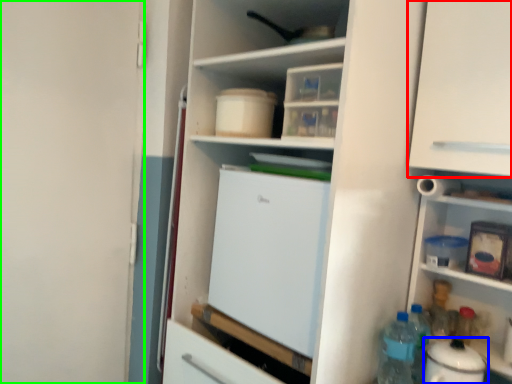
Question: Which object is positioned farthest from cabinetry (highlighted by a red box)? Select from appliance (highlighted by a blue box) and screen door (highlighted by a green box).

Choices:
 (A) appliance
 (B) screen door

Answer: (B)